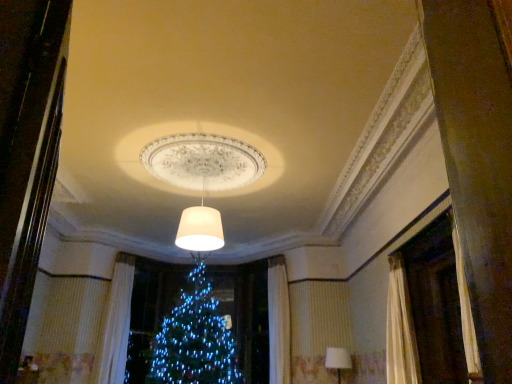
Question: Which direction should I rotate to look at white matte lampshade at center, positioned as the second lamp in back-to-front order?

Choices:
 (A) left
 (B) right

Answer: (A)

Question: Considering the relative positions of white fabric lampshade at lower right, marked as the 2th lamp in a front-to-back arrangement, and white matte lampshade at center, marked as the 2th lamp in a bottom-to-top arrangement, in the image provided, is white fabric lampshade at lower right, marked as the 2th lamp in a front-to-back arrangement, to the left of white matte lampshade at center, marked as the 2th lamp in a bottom-to-top arrangement, from the viewer's perspective?

Choices:
 (A) no
 (B) yes

Answer: (A)

Question: Is white fabric lampshade at lower right, marked as the 2th lamp in a front-to-back arrangement, thinner than white matte lampshade at center, positioned as the 1th lamp in top-to-bottom order?

Choices:
 (A) no
 (B) yes

Answer: (B)

Question: From a real-world perspective, is white fabric lampshade at lower right, marked as the 1th lamp in a bottom-to-top arrangement, physically above white matte lampshade at center, positioned as the second lamp in back-to-front order?

Choices:
 (A) no
 (B) yes

Answer: (A)

Question: Is white fabric lampshade at lower right, the second lamp in the left-to-right sequence, wider than white matte lampshade at center, the first lamp when ordered from left to right?

Choices:
 (A) no
 (B) yes

Answer: (A)

Question: Is white fabric lampshade at lower right, marked as the 2th lamp in a front-to-back arrangement, not within white matte lampshade at center, the first lamp when ordered from left to right?

Choices:
 (A) yes
 (B) no

Answer: (A)

Question: Is white fabric lampshade at lower right, marked as the 1th lamp in a bottom-to-top arrangement, smaller than white matte lampshade at center, positioned as the 1th lamp in top-to-bottom order?

Choices:
 (A) yes
 (B) no

Answer: (A)

Question: Is the surface of white matte lampshade at center, the second lamp viewed from the right, in direct contact with white textured curtain at left?

Choices:
 (A) no
 (B) yes

Answer: (A)

Question: Considering the relative positions of white matte lampshade at center, the second lamp viewed from the right, and white textured curtain at left in the image provided, is white matte lampshade at center, the second lamp viewed from the right, to the right of white textured curtain at left from the viewer's perspective?

Choices:
 (A) no
 (B) yes

Answer: (B)

Question: Does white matte lampshade at center, the second lamp viewed from the right, have a smaller size compared to white textured curtain at left?

Choices:
 (A) yes
 (B) no

Answer: (A)

Question: Is white textured curtain at left inside white matte lampshade at center, positioned as the second lamp in back-to-front order?

Choices:
 (A) yes
 (B) no

Answer: (B)

Question: Does white matte lampshade at center, the first lamp when ordered from left to right, have a greater height compared to white textured curtain at left?

Choices:
 (A) no
 (B) yes

Answer: (A)

Question: Does white matte lampshade at center, the second lamp viewed from the right, appear on the left side of white textured curtain at left?

Choices:
 (A) yes
 (B) no

Answer: (B)

Question: Can you see white matte lampshade at center, positioned as the 1th lamp in top-to-bottom order, touching white fabric lampshade at lower right, the second lamp in the left-to-right sequence?

Choices:
 (A) no
 (B) yes

Answer: (A)